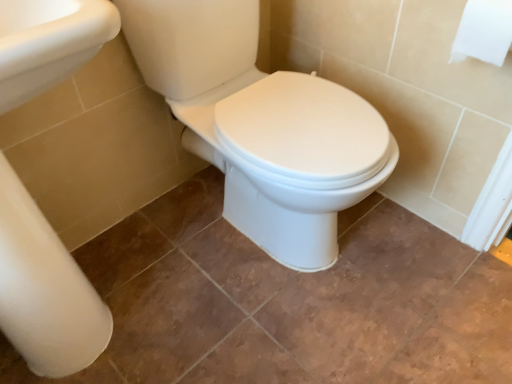
Describe the element at coordinates (261, 125) in the screenshot. I see `white glossy porcelain at center` at that location.

Identify the location of white glossy porcelain at center. The image size is (512, 384). (261, 125).

Locate an element on the screen. This screenshot has width=512, height=384. white paper at upper right is located at coordinates (484, 31).

The image size is (512, 384). Describe the element at coordinates (484, 31) in the screenshot. I see `white paper at upper right` at that location.

You are a GUI agent. You are given a task and a screenshot of the screen. Output one action in this format:
    pyautogui.click(x=<x>, y=<y>)
    Task: Click on the white glossy porcelain at center
    This screenshot has height=384, width=512.
    Given the screenshot: What is the action you would take?
    pyautogui.click(x=261, y=125)

Is white glossy porcelain at center to the left or to the right of white paper at upper right in the image?

From the image, it's evident that white glossy porcelain at center is to the left of white paper at upper right.

In the image, is white glossy porcelain at center positioned in front of or behind white paper at upper right?

Visually, white glossy porcelain at center is located in front of white paper at upper right.

Does point (163, 60) appear closer or farther from the camera than point (451, 58)?

Point (163, 60) is farther from the camera than point (451, 58).

From the image's perspective, which is below, white glossy porcelain at center or white paper at upper right?

white glossy porcelain at center.

From a real-world perspective, which is physically above, white glossy porcelain at center or white paper at upper right?

white paper at upper right, from a real-world perspective.

Considering the sizes of objects white glossy porcelain at center and white paper at upper right in the image provided, who is wider, white glossy porcelain at center or white paper at upper right?

With larger width is white glossy porcelain at center.

In terms of height, does white glossy porcelain at center look taller or shorter compared to white paper at upper right?

Considering their sizes, white glossy porcelain at center has more height than white paper at upper right.

Considering the sizes of white glossy porcelain at center and white paper at upper right in the image, is white glossy porcelain at center bigger or smaller than white paper at upper right?

Clearly, white glossy porcelain at center is larger in size than white paper at upper right.

Would you say white glossy porcelain at center contains white paper at upper right?

No, white paper at upper right is not surrounded by white glossy porcelain at center.

Does white glossy porcelain at center touch white paper at upper right?

No, white glossy porcelain at center is not touching white paper at upper right.

Is white glossy porcelain at center positioned with its back to white paper at upper right?

white glossy porcelain at center does not have its back to white paper at upper right.

This screenshot has width=512, height=384. I want to click on porcelain to the left of white paper at upper right, so click(261, 125).

Considering the positions of objects white paper at upper right and white glossy porcelain at center in the image provided, who is more to the left, white paper at upper right or white glossy porcelain at center?

white glossy porcelain at center.

Does white paper at upper right come in front of white glossy porcelain at center?

No, it is behind white glossy porcelain at center.

Is point (456, 43) in front of point (296, 154)?

Yes, it is.

From the image's perspective, is white paper at upper right located above white glossy porcelain at center?

Yes, from the image's perspective, white paper at upper right is on top of white glossy porcelain at center.

From a real-world perspective, is white paper at upper right beneath white glossy porcelain at center?

No, from a real-world perspective, white paper at upper right is not below white glossy porcelain at center.

Which of these two, white paper at upper right or white glossy porcelain at center, is wider?

white glossy porcelain at center is wider.

Does white paper at upper right have a lesser height compared to white glossy porcelain at center?

Correct, white paper at upper right is not as tall as white glossy porcelain at center.

Considering the relative sizes of white paper at upper right and white glossy porcelain at center in the image provided, is white paper at upper right bigger than white glossy porcelain at center?

Actually, white paper at upper right might be smaller than white glossy porcelain at center.

In the scene shown: Is white paper at upper right situated inside white glossy porcelain at center or outside?

white paper at upper right is located beyond the bounds of white glossy porcelain at center.

In the scene shown: Is the surface of white paper at upper right in direct contact with white glossy porcelain at center?

No.

Could you tell me if white paper at upper right is facing white glossy porcelain at center?

No, white paper at upper right is not facing towards white glossy porcelain at center.

How different are the orientations of white paper at upper right and white glossy porcelain at center in degrees?

The angle between the facing direction of white paper at upper right and the facing direction of white glossy porcelain at center is 89.4 degrees.

How far apart are white paper at upper right and white glossy porcelain at center?

white paper at upper right is 18.64 inches from white glossy porcelain at center.

What are the coordinates of `toilet paper above the white glossy porcelain at center (from the image's perspective)` in the screenshot? It's located at (484, 31).

You are a GUI agent. You are given a task and a screenshot of the screen. Output one action in this format:
    pyautogui.click(x=<x>, y=<y>)
    Task: Click on the toilet paper above the white glossy porcelain at center (from the image's perspective)
    
    Given the screenshot: What is the action you would take?
    pyautogui.click(x=484, y=31)

The width and height of the screenshot is (512, 384). What are the coordinates of `toilet paper positioned vertically above the white glossy porcelain at center (from a real-world perspective)` in the screenshot? It's located at (484, 31).